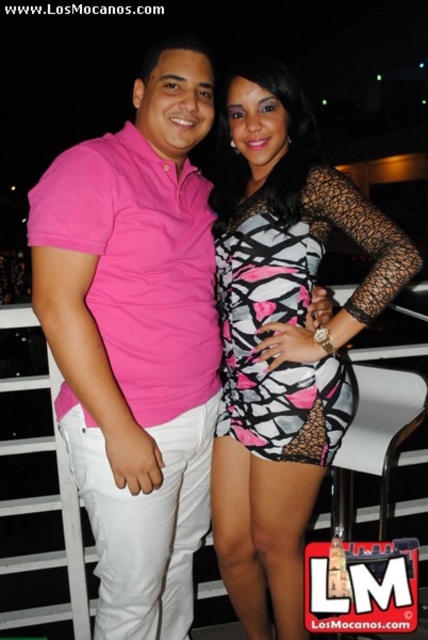
Is pink cotton polo shirt at left wider than zebra-patterned fabric dress at center?

Indeed, pink cotton polo shirt at left has a greater width compared to zebra-patterned fabric dress at center.

Image resolution: width=428 pixels, height=640 pixels. What do you see at coordinates (136, 340) in the screenshot?
I see `pink cotton polo shirt at left` at bounding box center [136, 340].

Find the location of a particular element. pink cotton polo shirt at left is located at coordinates (136, 340).

The width and height of the screenshot is (428, 640). I want to click on pink cotton polo shirt at left, so click(136, 340).

What do you see at coordinates (136, 340) in the screenshot?
I see `pink cotton polo shirt at left` at bounding box center [136, 340].

At what (x,y) coordinates should I click in order to perform the action: click on pink cotton polo shirt at left. Please return your answer as a coordinate pair (x, y). Looking at the image, I should click on pos(136,340).

Does pink and white geometric dress at center have a larger size compared to zebra-patterned fabric dress at center?

Indeed, pink and white geometric dress at center has a larger size compared to zebra-patterned fabric dress at center.

How far apart are pink and white geometric dress at center and zebra-patterned fabric dress at center?

pink and white geometric dress at center and zebra-patterned fabric dress at center are 3.04 inches apart from each other.

Between point (252, 132) and point (259, 404), which one is positioned in front?

Point (259, 404) is in front.

This screenshot has width=428, height=640. I want to click on pink and white geometric dress at center, so click(x=282, y=339).